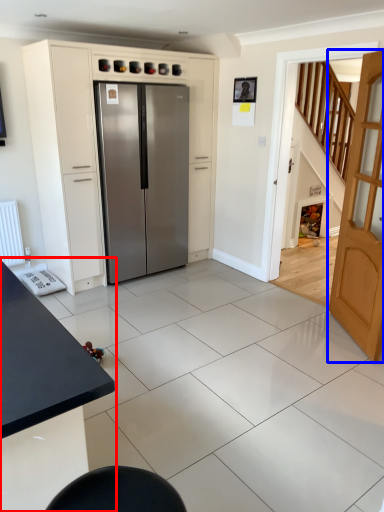
Question: Which point is further to the camera, table (highlighted by a red box) or door (highlighted by a blue box)?

Choices:
 (A) table
 (B) door

Answer: (B)